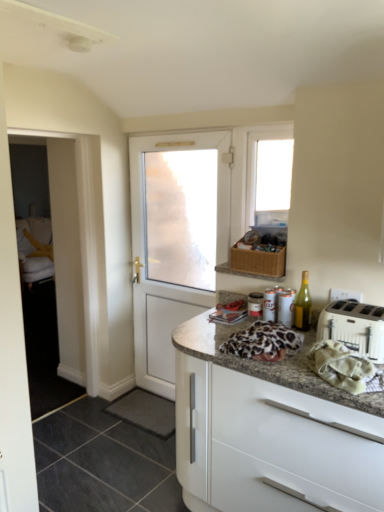
Find the location of a particular element. This screenshot has width=384, height=512. vacant space in front of white matte door at center is located at coordinates (137, 453).